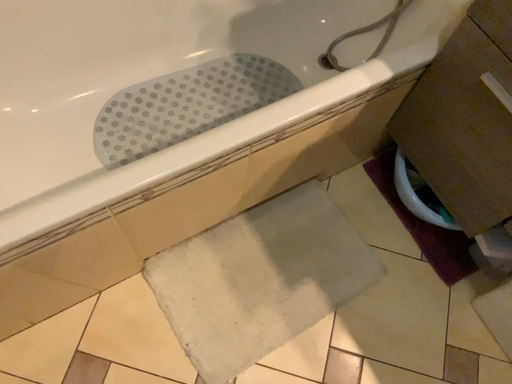
Where is `free spot to the right of white soft bath mat at lower center, which ranks as the first bath mat in left-to-right order`? This screenshot has height=384, width=512. free spot to the right of white soft bath mat at lower center, which ranks as the first bath mat in left-to-right order is located at coordinates (394, 315).